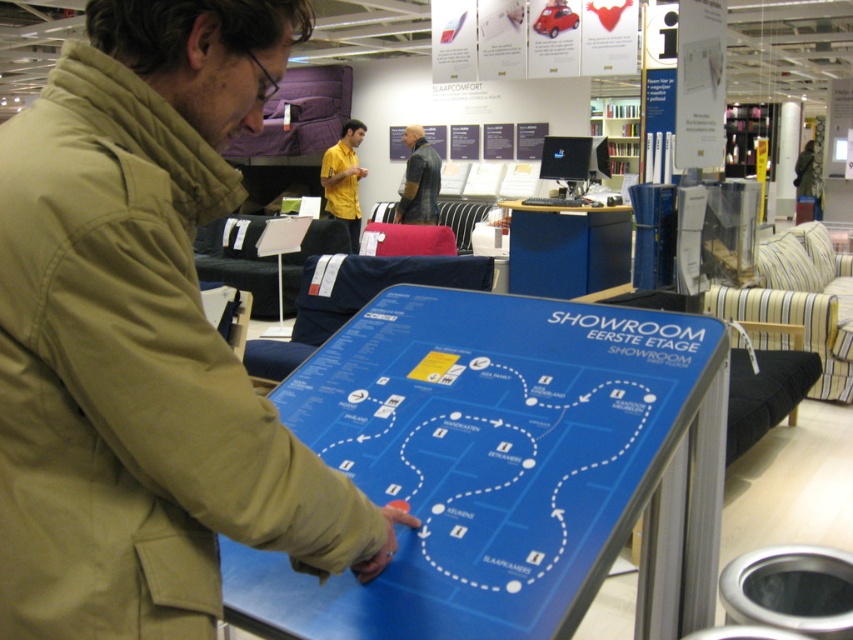
In the scene shown: How distant is khaki cotton trench coat at center from blue glossy map at center?

18.06 inches

Does khaki cotton trench coat at center have a lesser height compared to blue glossy map at center?

Incorrect, khaki cotton trench coat at center's height does not fall short of blue glossy map at center's.

Locate an element on the screen. The image size is (853, 640). khaki cotton trench coat at center is located at coordinates (144, 339).

Does khaki cotton trench coat at center have a greater width compared to blue laminate desk at center?

Incorrect, khaki cotton trench coat at center's width does not surpass blue laminate desk at center's.

Between khaki cotton trench coat at center and blue laminate desk at center, which one is positioned lower?

khaki cotton trench coat at center is lower down.

The image size is (853, 640). Find the location of `khaki cotton trench coat at center`. khaki cotton trench coat at center is located at coordinates (144, 339).

Which is in front, point (566, 259) or point (357, 248)?

Point (566, 259) is in front.

What do you see at coordinates (567, 248) in the screenshot? The height and width of the screenshot is (640, 853). I see `blue laminate desk at center` at bounding box center [567, 248].

Between point (595, 221) and point (334, 164), which one is positioned in front?

Positioned in front is point (595, 221).

This screenshot has height=640, width=853. In order to click on blue laminate desk at center in this screenshot , I will do `click(567, 248)`.